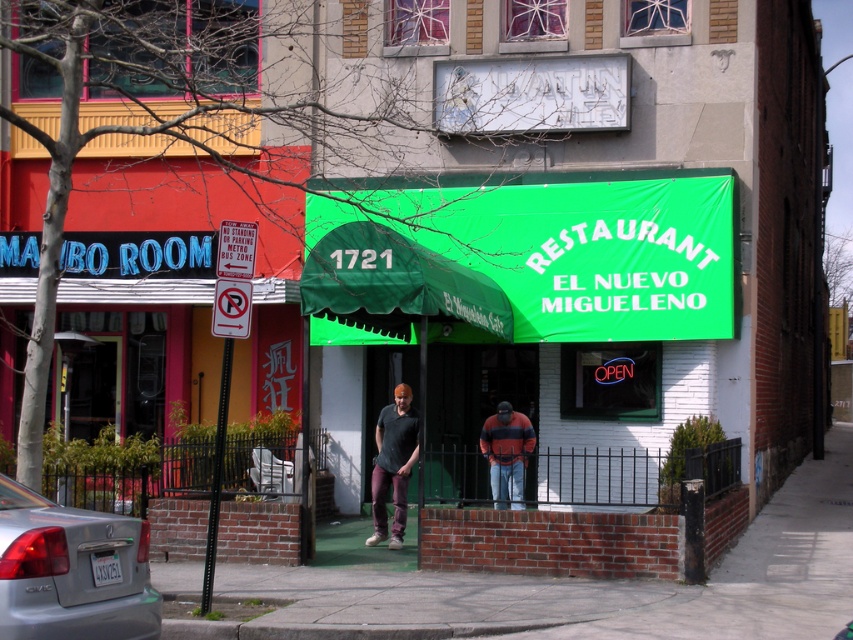
Question: Does green concrete pavement at center appear on the right side of silver metallic sedan at lower left?

Choices:
 (A) yes
 (B) no

Answer: (A)

Question: Which point is farther from the camera taking this photo?

Choices:
 (A) (32, 516)
 (B) (393, 486)
 (C) (485, 433)

Answer: (C)

Question: Is green fabric awning at center bigger than silver metallic sedan at lower left?

Choices:
 (A) no
 (B) yes

Answer: (B)

Question: Which point is closer to the camera?

Choices:
 (A) (138, 620)
 (B) (567, 204)
 (C) (508, 445)
 (D) (781, 602)

Answer: (A)

Question: Estimate the real-world distances between objects in this image. Which object is closer to the green concrete pavement at center?

Choices:
 (A) striped sweater at center
 (B) green fabric awning at center

Answer: (A)

Question: Is silver metallic sedan at lower left to the right of striped sweater at center from the viewer's perspective?

Choices:
 (A) yes
 (B) no

Answer: (B)